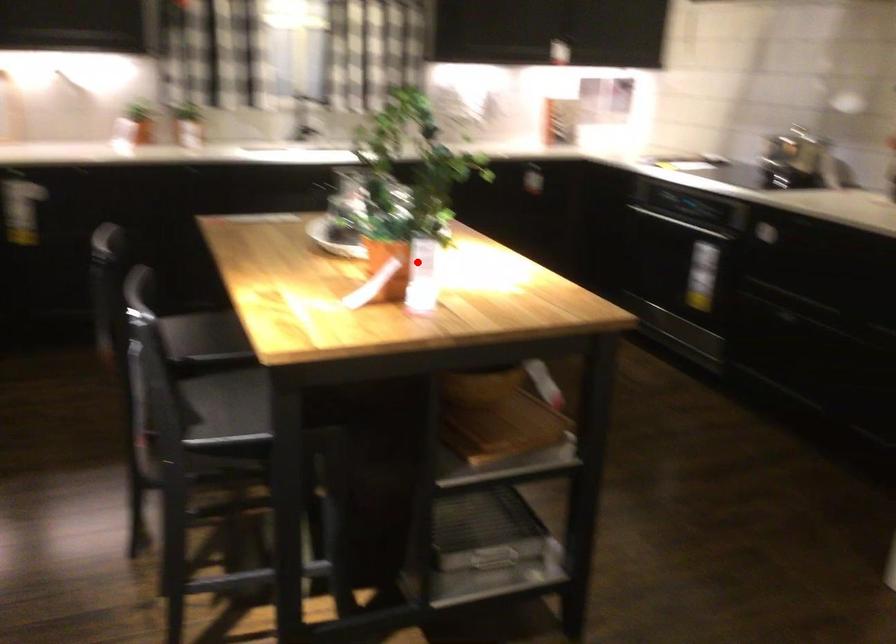
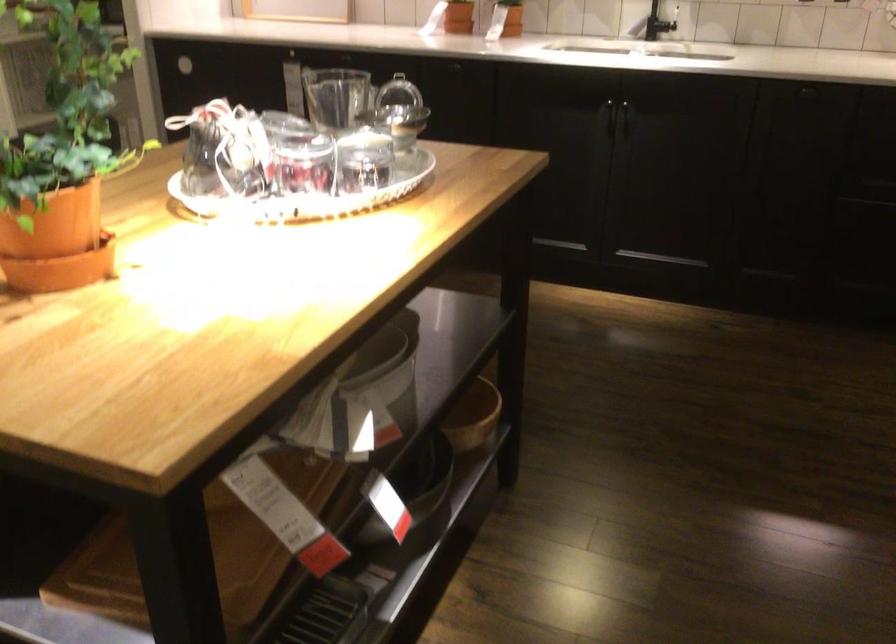
Question: I am providing you with two images of the same scene from different viewpoints. In image1, a red point is highlighted. Considering the same 3D point in image2, which of the following is correct?

Choices:
 (A) It is closer
 (B) It is farther

Answer: (A)